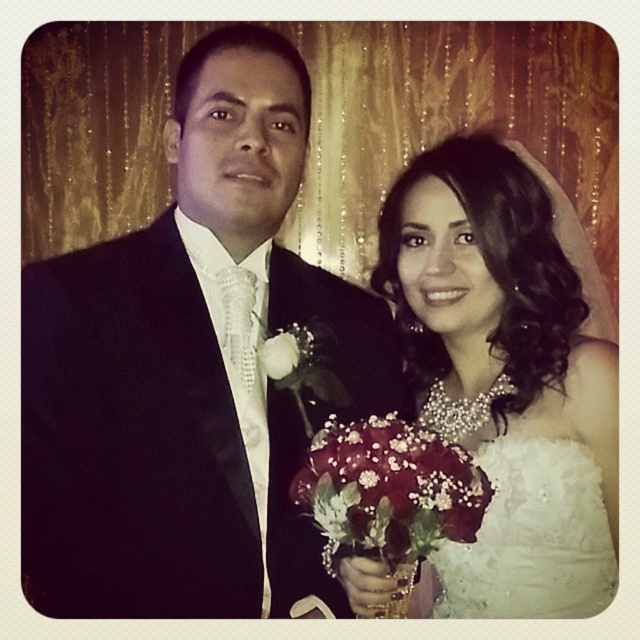
Who is shorter, black satin tuxedo at left or white satin dress at center?

black satin tuxedo at left is shorter.

Based on the photo, is black satin tuxedo at left to the right of white satin dress at center from the viewer's perspective?

Incorrect, black satin tuxedo at left is not on the right side of white satin dress at center.

Who is more distant from viewer, [272,448] or [506,259]?

Positioned behind is point [506,259].

This screenshot has width=640, height=640. In order to click on black satin tuxedo at left in this screenshot , I will do `click(189, 371)`.

From the picture: Can you confirm if white lace dress at lower right is positioned to the left of white silk rose at center?

No, white lace dress at lower right is not to the left of white silk rose at center.

Who is more forward, [598,595] or [266,355]?

Point [266,355] is more forward.

Find the location of a particular element. This screenshot has height=640, width=640. white lace dress at lower right is located at coordinates (531, 538).

Image resolution: width=640 pixels, height=640 pixels. What are the coordinates of `black satin tuxedo at left` in the screenshot? It's located at (189, 371).

Is black satin tuxedo at left thinner than white lace dress at lower right?

No, black satin tuxedo at left is not thinner than white lace dress at lower right.

Find the location of a particular element. The height and width of the screenshot is (640, 640). black satin tuxedo at left is located at coordinates coord(189,371).